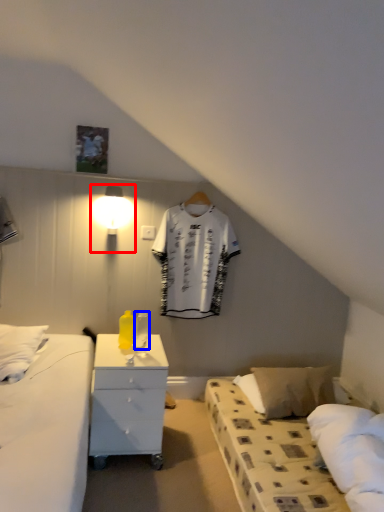
Question: Which point is further to the camera, light fixture (highlighted by a red box) or bottle (highlighted by a blue box)?

Choices:
 (A) light fixture
 (B) bottle

Answer: (A)